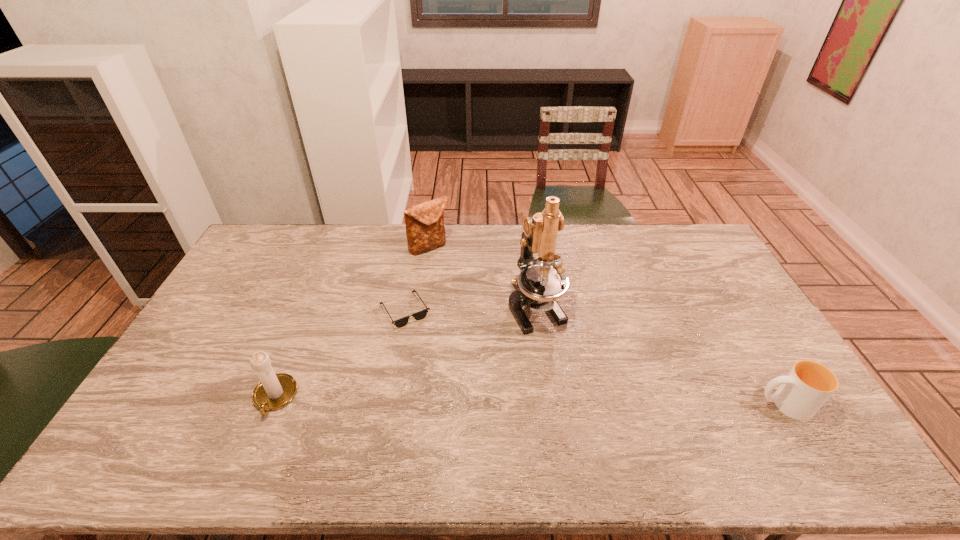
The width and height of the screenshot is (960, 540). In order to click on free space between the shortest object and the fourth tallest object in this screenshot , I will do `click(594, 358)`.

I want to click on empty location between the second object from right to left and the cup, so [x=660, y=356].

Locate an element on the screen. This screenshot has width=960, height=540. empty space between the farthest object and the shortest object is located at coordinates (417, 279).

The width and height of the screenshot is (960, 540). Identify the location of free space between the leftmost object and the microscope. (405, 352).

Image resolution: width=960 pixels, height=540 pixels. I want to click on free space between the candle holder and the clutch bag, so click(352, 322).

Locate an element on the screen. This screenshot has height=540, width=960. empty space between the clutch bag and the fourth tallest object is located at coordinates (607, 326).

Where is `free spot between the candle holder and the fourth object from left to right`? This screenshot has height=540, width=960. free spot between the candle holder and the fourth object from left to right is located at coordinates (405, 352).

Where is `vacant point located between the leftmost object and the rightmost object`? Image resolution: width=960 pixels, height=540 pixels. vacant point located between the leftmost object and the rightmost object is located at coordinates (529, 401).

Choose which object is the second nearest neighbor to the farthest object. Please provide its 2D coordinates. Your answer should be formatted as a tuple, i.e. [(x, y)], where the tuple contains the x and y coordinates of a point satisfying the conditions above.

[(541, 281)]

Identify which object is the third nearest to the shortest object. Please provide its 2D coordinates. Your answer should be formatted as a tuple, i.e. [(x, y)], where the tuple contains the x and y coordinates of a point satisfying the conditions above.

[(541, 281)]